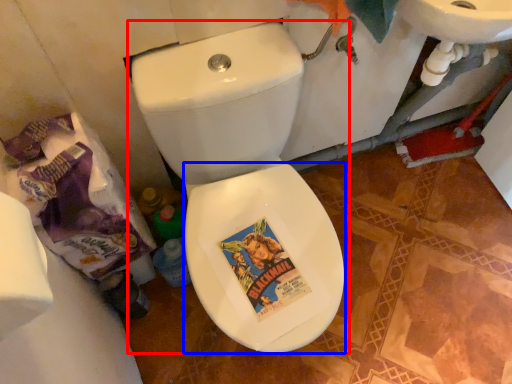
Question: Which of the following is the farthest to the observer, toilet (highlighted by a red box) or bidet (highlighted by a blue box)?

Choices:
 (A) toilet
 (B) bidet

Answer: (B)